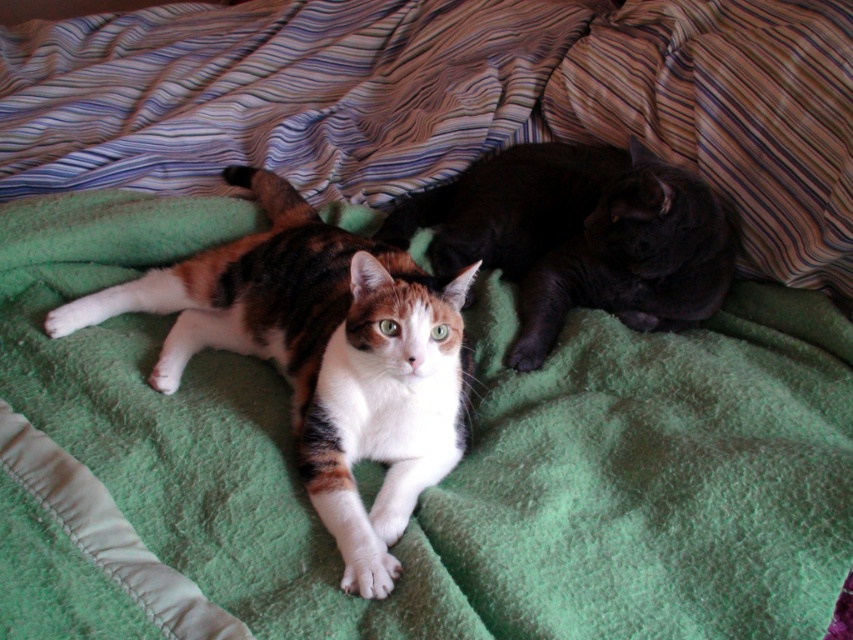
Question: Is calico fur cat at center above black glossy cat at upper right?

Choices:
 (A) yes
 (B) no

Answer: (B)

Question: Is calico fur cat at center further to the viewer compared to black glossy cat at upper right?

Choices:
 (A) no
 (B) yes

Answer: (A)

Question: Among these objects, which one is nearest to the camera?

Choices:
 (A) black glossy cat at upper right
 (B) calico fur cat at center

Answer: (B)

Question: In this image, where is calico fur cat at center located relative to black glossy cat at upper right?

Choices:
 (A) left
 (B) right

Answer: (A)

Question: Among these objects, which one is farthest from the camera?

Choices:
 (A) black glossy cat at upper right
 (B) calico fur cat at center

Answer: (A)

Question: Which of the following is the farthest from the observer?

Choices:
 (A) (349, 461)
 (B) (648, 220)

Answer: (B)